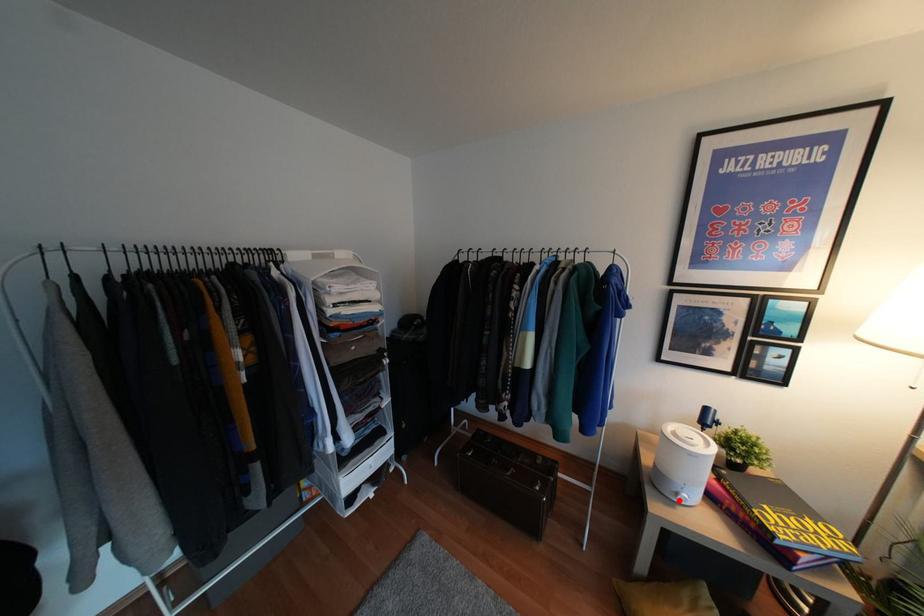
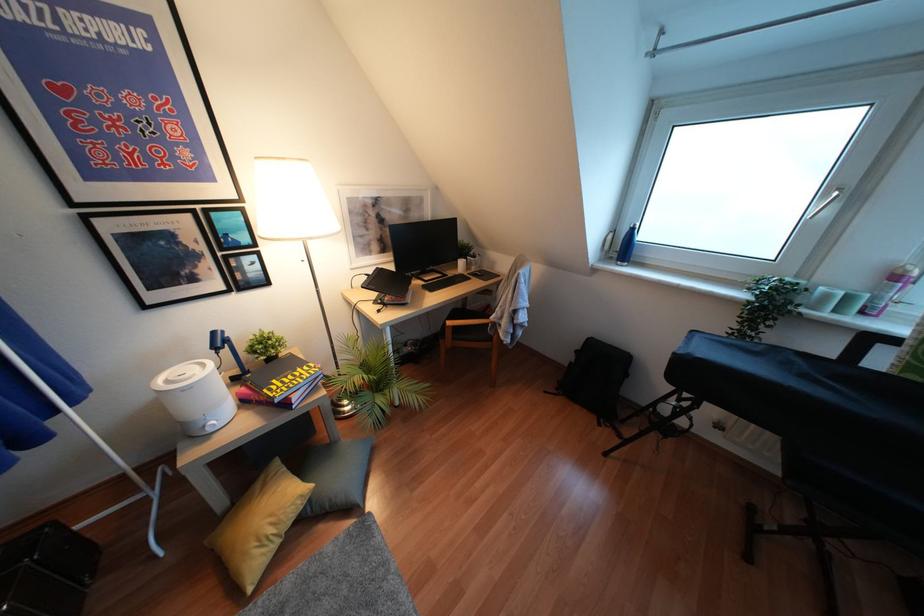
Locate, in the second image, the point that corresponds to the highlighted location in the first image.

(210, 430)